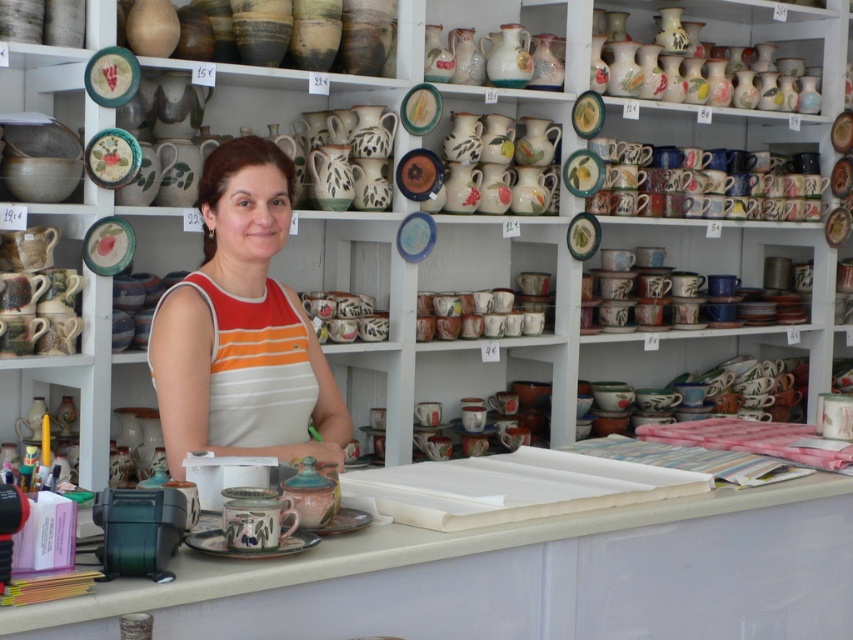
You are a customer standing in front of the counter in the pottery shop. You want to hand the woman a note that is in your pocket. The note is 3 feet away from you. Can you reach the orange striped tank top at center to give her the note without moving closer?

The orange striped tank top at center is 8.17 feet away from the viewer. Since the note is 3 feet away from you, you cannot reach the orange striped tank top at center to give her the note without moving closer because the distance is greater than the reach of 3 feet.

You are a customer in the pottery shop and want to place an order. Where is the white laminate counter at center located in relation to the shelves behind the woman?

The white laminate counter at center is located at point (518, 577), which places it centrally in the scene between the woman and the shelves behind her, making it the ideal spot for placing your order.